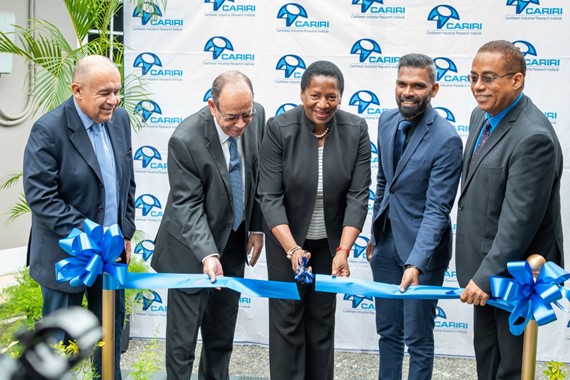
Identify the location of window. The height and width of the screenshot is (380, 570). (118, 23).